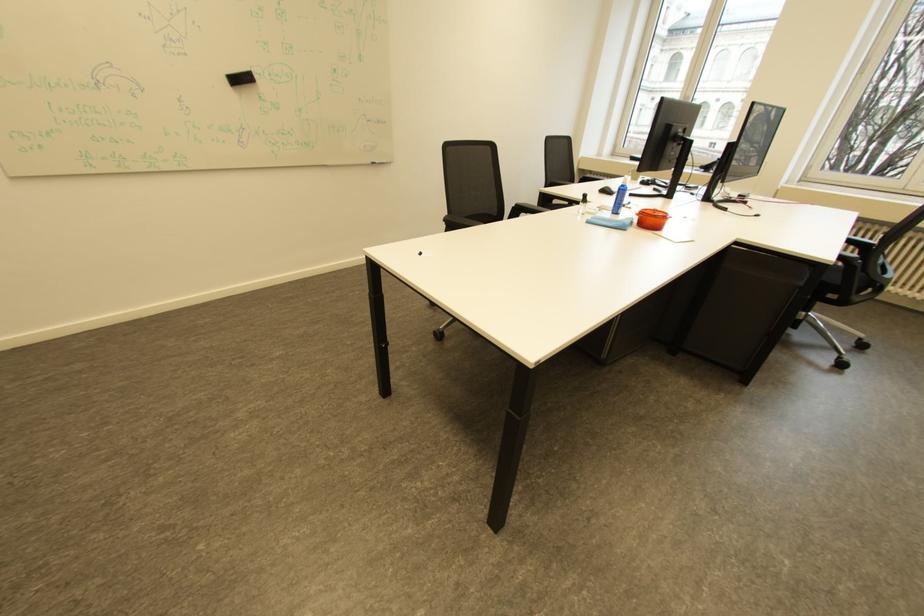
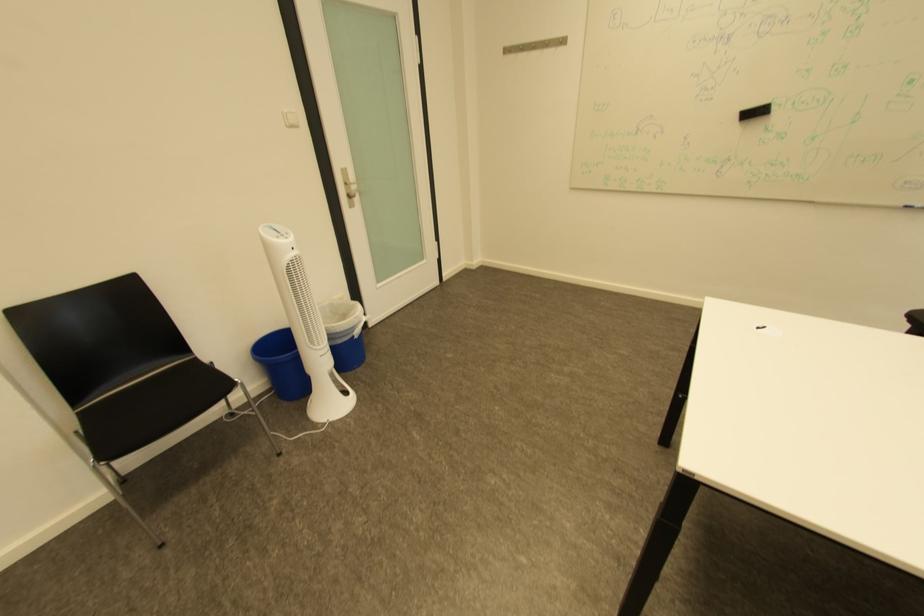
The first image is from the beginning of the video and the second image is from the end. How did the camera likely rotate when shooting the video?

The rotation direction of the camera is left-down.